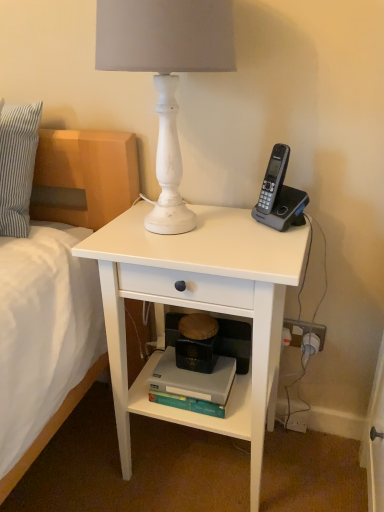
I want to click on vacant space underneath white matte desk at center (from a real-world perspective), so click(x=194, y=460).